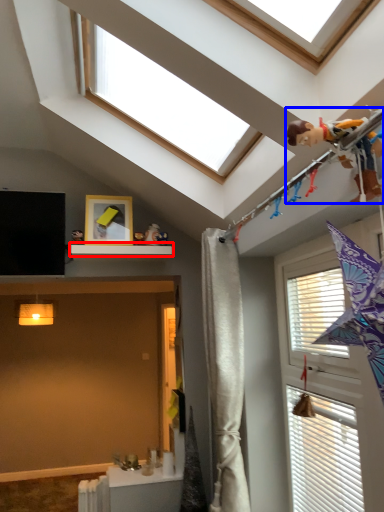
Question: Which of the following is the farthest to the observer, shelf (highlighted by a red box) or child (highlighted by a blue box)?

Choices:
 (A) shelf
 (B) child

Answer: (A)